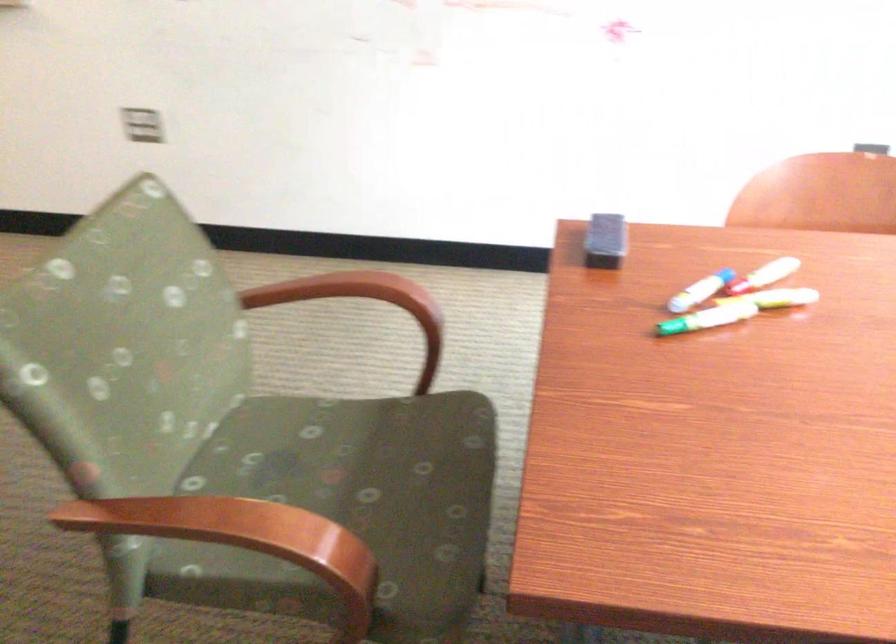
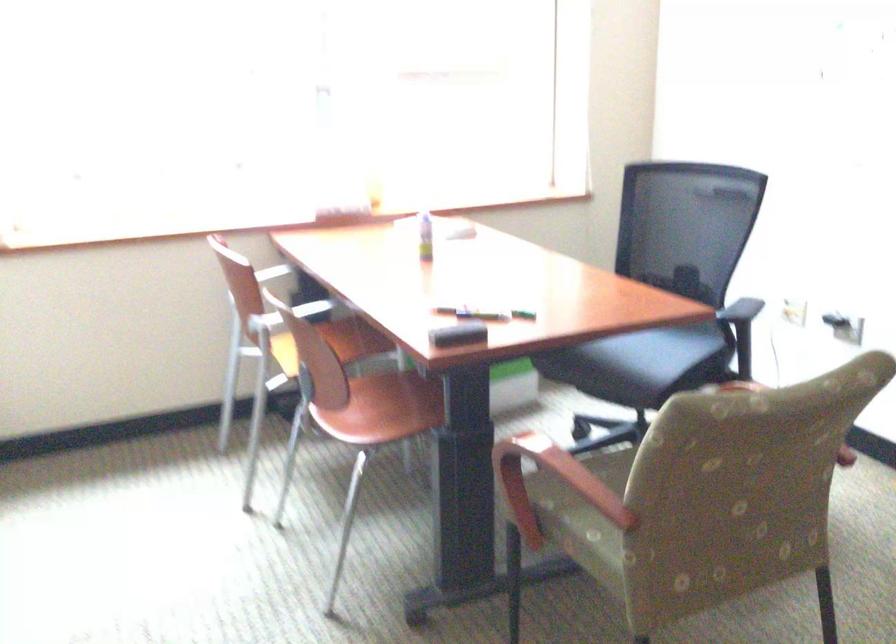
Locate, in the second image, the point that corresponds to point 450,527 in the first image.

(616, 460)